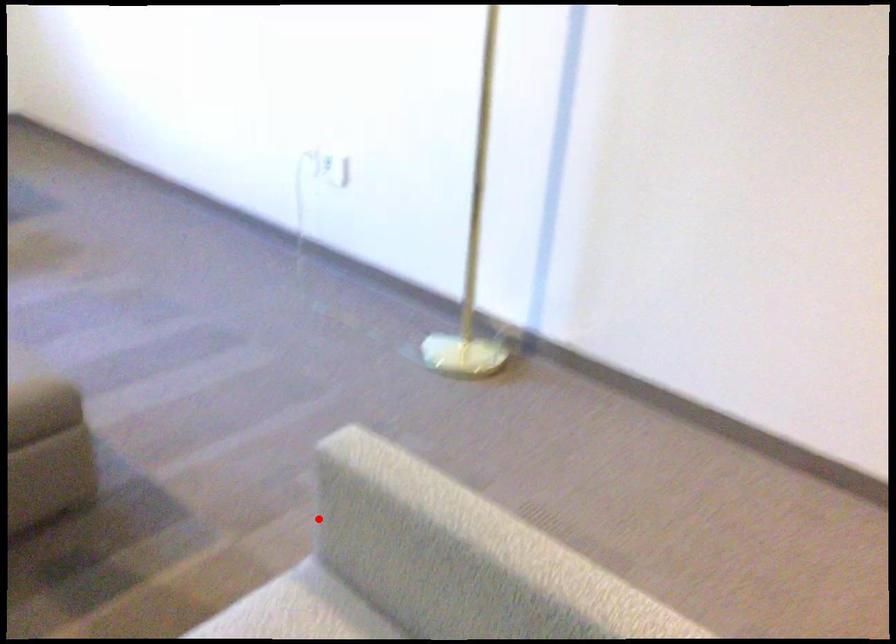
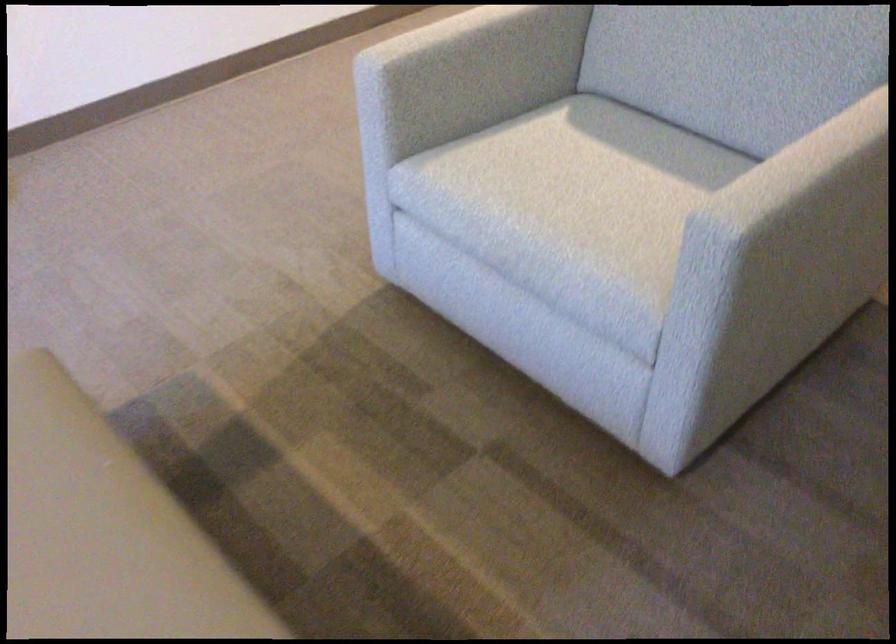
Where in the second image is the point corresponding to the highlighted location from the first image?

(385, 120)